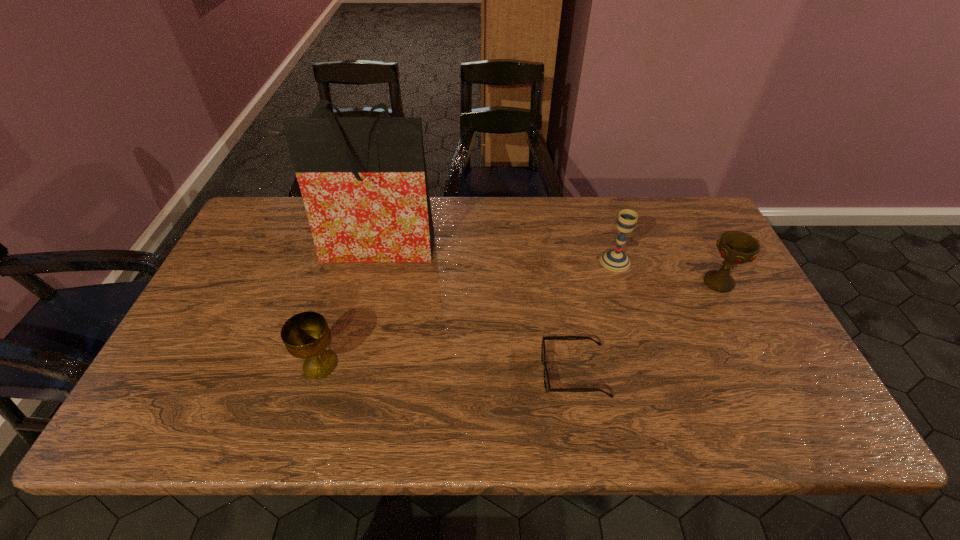
Locate an element on the screen. This screenshot has height=540, width=960. vacant point located between the rightmost object and the second chalice from left to right is located at coordinates (667, 272).

What are the coordinates of `object that ranks as the third closest to the rightmost chalice` in the screenshot? It's located at (363, 180).

You are a GUI agent. You are given a task and a screenshot of the screen. Output one action in this format:
    pyautogui.click(x=<x>, y=<y>)
    Task: Click on the object that stands as the closest to the second chalice from right to left
    
    Given the screenshot: What is the action you would take?
    pos(735,247)

Identify which chalice is the second nearest to the tallest object. Please provide its 2D coordinates. Your answer should be formatted as a tuple, i.e. [(x, y)], where the tuple contains the x and y coordinates of a point satisfying the conditions above.

[(615, 260)]

Identify which chalice is located as the third nearest to the shopping bag. Please provide its 2D coordinates. Your answer should be formatted as a tuple, i.e. [(x, y)], where the tuple contains the x and y coordinates of a point satisfying the conditions above.

[(735, 247)]

You are a GUI agent. You are given a task and a screenshot of the screen. Output one action in this format:
    pyautogui.click(x=<x>, y=<y>)
    Task: Click on the free space that satisfies the following two spatial constraints: 1. on the back side of the second chalice from right to left; 2. on the left side of the nearest chalice
    The image size is (960, 540).
    Given the screenshot: What is the action you would take?
    pyautogui.click(x=350, y=261)

At what (x,y) coordinates should I click in order to perform the action: click on vacant space that satisfies the following two spatial constraints: 1. on the front side of the rightmost chalice; 2. on the right side of the shopping bag. Please return your answer as a coordinate pair (x, y). Looking at the image, I should click on (362, 282).

Image resolution: width=960 pixels, height=540 pixels. I want to click on vacant space that satisfies the following two spatial constraints: 1. on the front side of the fourth object from left to right; 2. on the left side of the tallest object, so click(368, 261).